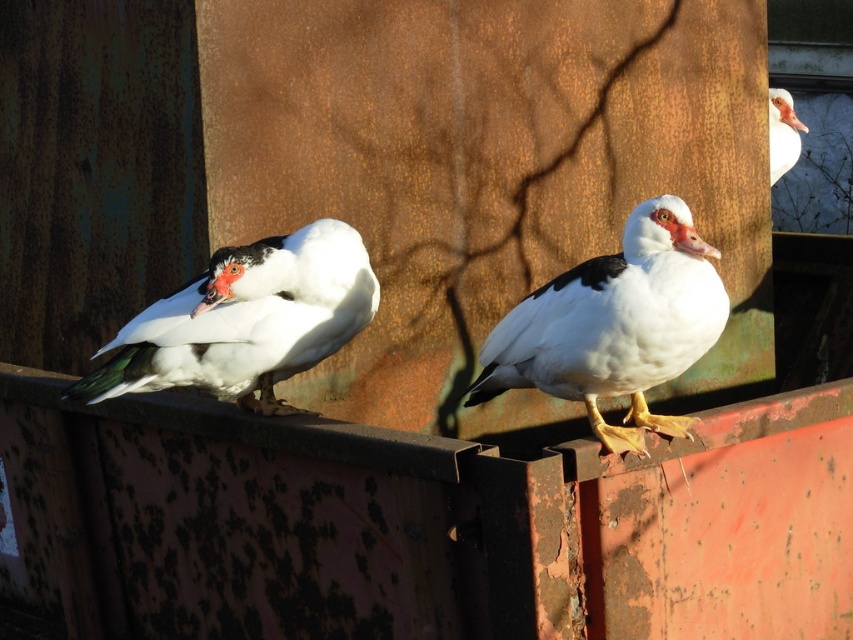
Question: Which point is closer to the camera?

Choices:
 (A) white matte duck at center
 (B) white matte duck at left

Answer: (A)

Question: Estimate the real-world distances between objects in this image. Which object is farther from the white matte duck at center?

Choices:
 (A) white matte duck at left
 (B) white matte duck at upper right

Answer: (B)

Question: Is white matte duck at center closer to camera compared to white matte duck at left?

Choices:
 (A) yes
 (B) no

Answer: (A)

Question: Can you confirm if white matte duck at center is positioned above white matte duck at left?

Choices:
 (A) yes
 (B) no

Answer: (B)

Question: Among these objects, which one is nearest to the camera?

Choices:
 (A) white matte duck at center
 (B) white matte duck at upper right

Answer: (A)

Question: Can you confirm if white matte duck at center is positioned to the left of white matte duck at left?

Choices:
 (A) no
 (B) yes

Answer: (A)